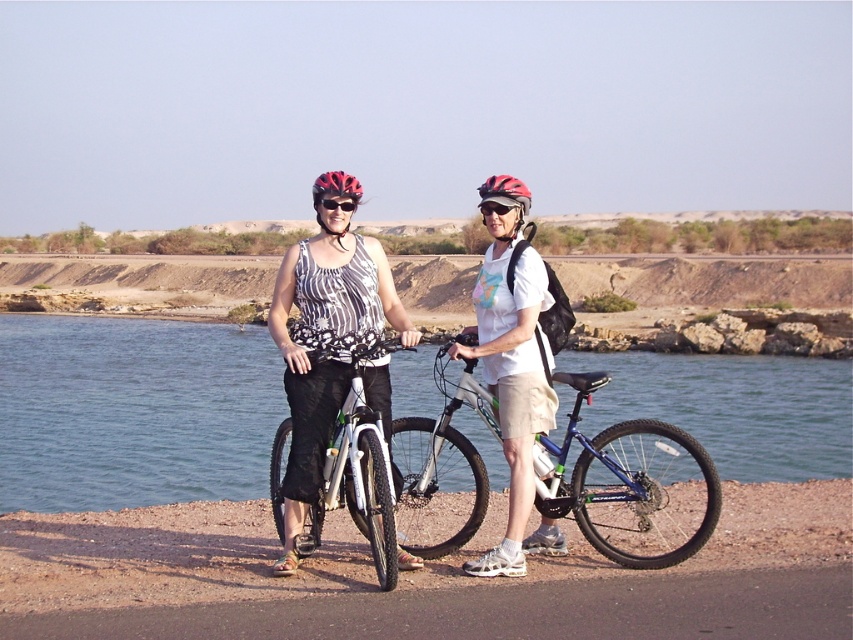
Where is the matte black helmet at center located in the image?

The matte black helmet at center is located at point coordinates of (505, 193) in the image.

You are standing at the point where the image was taken. A friend is holding a rope that is tied to a post located at point (515, 189). If the rope is 8 meters long, can your friend reach you by pulling the rope? Please explain your reasoning.

The distance between point (515, 189) and the viewer is 8.49 meters. Since the rope is only 8 meters long, it is 0.49 meters shorter than the required distance. Therefore, your friend cannot reach you by pulling the rope.

You are planning to cross the water area in the image. There are two marked points, point (381, 374) and point (323, 198). Which point should you avoid stepping on to stay safe?

Point (381, 374) is behind point (323, 198), so you should avoid stepping on point (381, 374) because it is further away from you and might be deeper water.